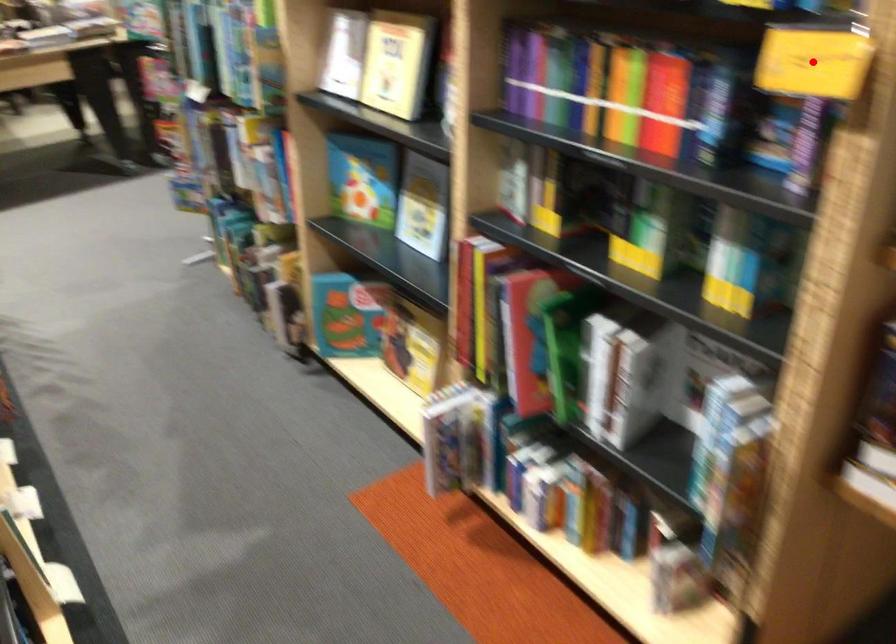
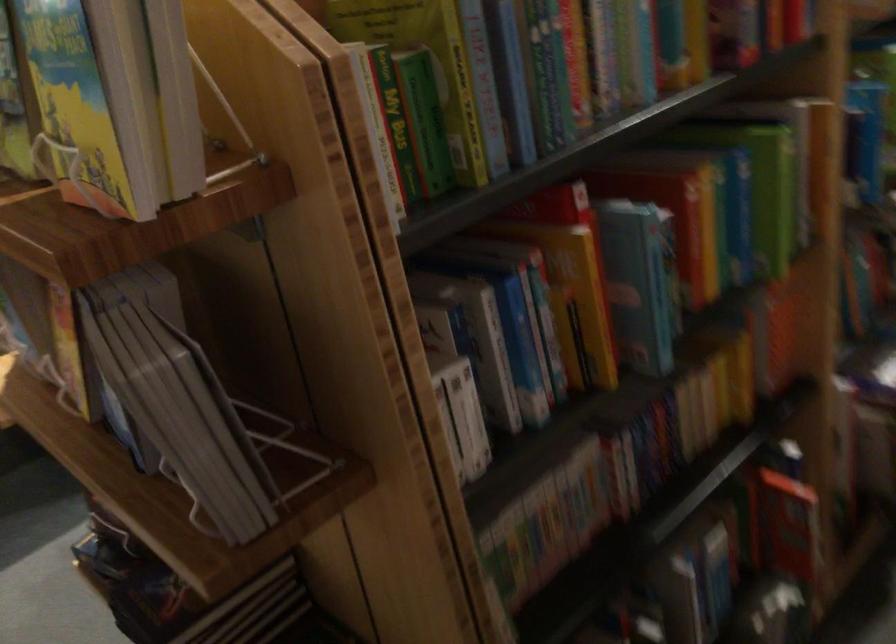
Question: I am providing you with two images of the same scene from different viewpoints. A red point is marked on the first image. Can you still see the location of the red point in image 2?

Choices:
 (A) Yes
 (B) No

Answer: (B)